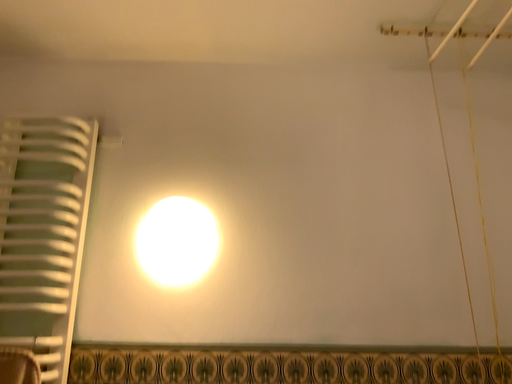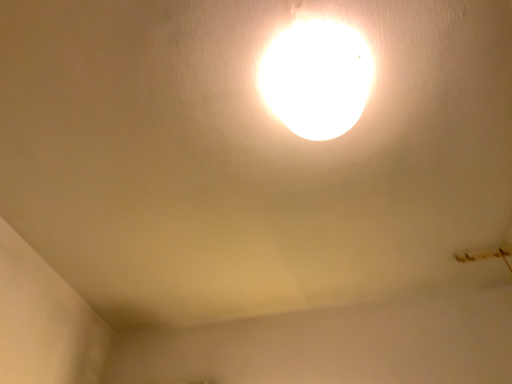
Question: How did the camera likely rotate when shooting the video?

Choices:
 (A) rotated right
 (B) rotated left

Answer: (B)